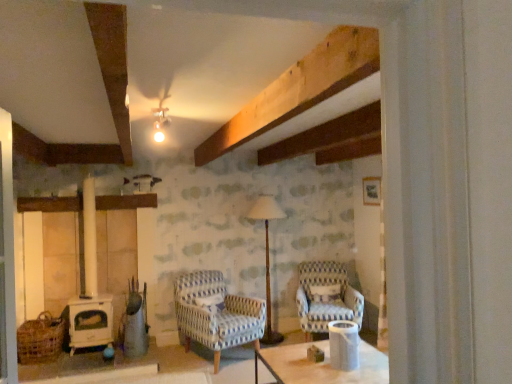
Question: Considering the relative positions of white glossy cylindrical container at center and woven brown basket at lower left in the image provided, is white glossy cylindrical container at center to the left or to the right of woven brown basket at lower left?

Choices:
 (A) left
 (B) right

Answer: (B)

Question: From the image's perspective, is white glossy cylindrical container at center above or below woven brown basket at lower left?

Choices:
 (A) below
 (B) above

Answer: (B)

Question: Estimate the real-world distances between objects in this image. Which object is farther from the blue and white striped fabric armchair at center-right, which appears as the 1th chair when viewed from the right?

Choices:
 (A) wooden floor lamp at center
 (B) woven brown basket at lower left
 (C) white glossy cylindrical container at center
 (D) blue and white woven fabric armchair at center, which ranks as the 2th chair in right-to-left order

Answer: (B)

Question: Which of these objects is positioned closest to the blue and white woven fabric armchair at center, acting as the 1th chair starting from the left?

Choices:
 (A) white glossy cylindrical container at center
 (B) wooden floor lamp at center
 (C) woven brown basket at lower left
 (D) blue and white striped fabric armchair at center-right, positioned as the 2th chair in left-to-right order

Answer: (B)